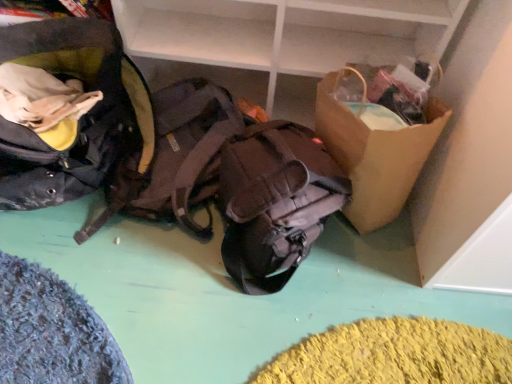
Locate an element on the screen. Image resolution: width=512 pixels, height=384 pixels. vacant space in front of matte brown backpack at center, the third backpack in the left-to-right sequence is located at coordinates (250, 338).